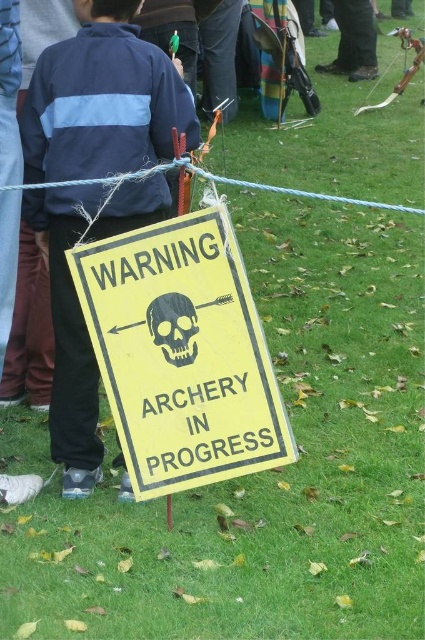
You are standing in the archery range and see two points marked in the scene. The first point is at coordinates point (237, 356) and the second is at point (82, 19). Which point is closer to you?

Point (237, 356) is closer to the camera than point (82, 19), so the first point is closer to you.

Looking at this image, you are standing at the point marked as point [56,356] in the scene. If you want to take a photo of the archery warning sign with your camera, which is 9.72 feet away from you, will you be able to capture the entire sign in the frame without moving closer or farther?

The camera is 9.72 feet away from the point [56,356]. Since the archery warning sign is within that distance, you should be able to capture the entire sign in the frame without moving closer or farther, provided the camera has an appropriate lens or zoom capability.